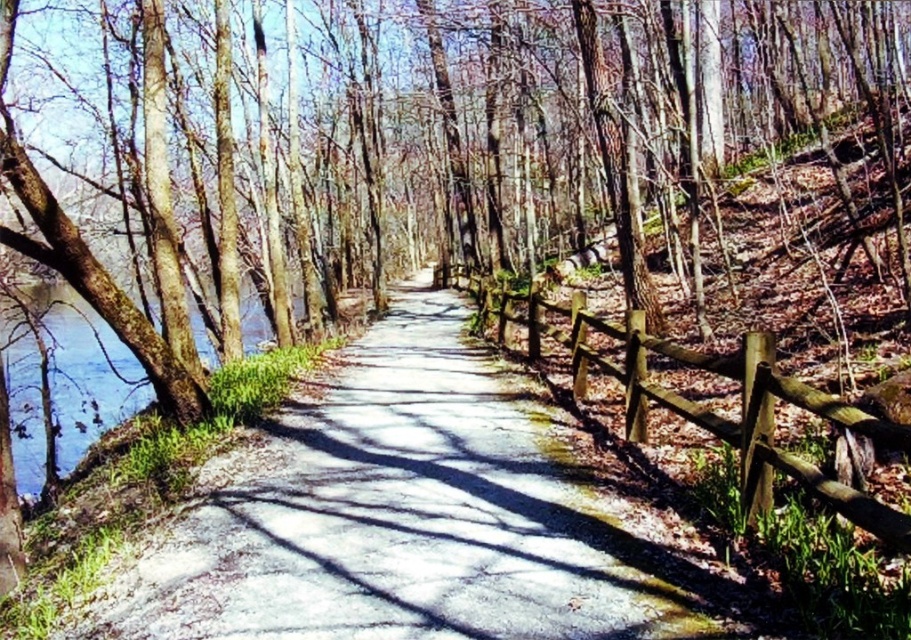
Is smooth concrete path at center further to camera compared to brown wooden fence at right?

Yes.

Looking at this image, is smooth concrete path at center below brown wooden fence at right?

Yes, smooth concrete path at center is below brown wooden fence at right.

Is point (452, 628) closer to viewer compared to point (612, 333)?

Yes.

This screenshot has height=640, width=911. In order to click on smooth concrete path at center in this screenshot , I will do `click(402, 518)`.